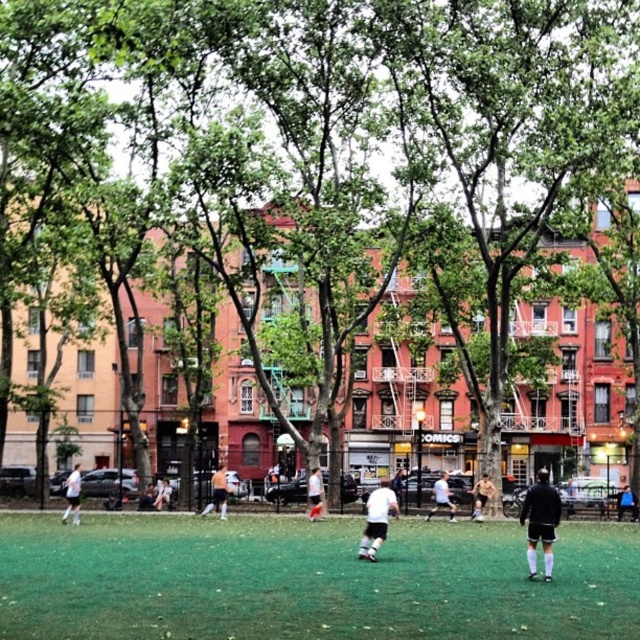
How far apart are white matte soccer player at center and black matte jacket at center?

white matte soccer player at center is 102.49 feet from black matte jacket at center.

Is point (385, 522) closer to viewer compared to point (621, 496)?

Yes, point (385, 522) is closer to viewer.

Is point (380, 518) positioned before point (630, 496)?

That is True.

The width and height of the screenshot is (640, 640). In order to click on white matte soccer player at center in this screenshot , I will do `click(378, 518)`.

Between green artificial turf at center and black matte shorts at center, which one is positioned higher?

Positioned higher is black matte shorts at center.

Between point (275, 627) and point (545, 468), which one is positioned behind?

Point (545, 468)

Find the location of `green artificial turf at center`. green artificial turf at center is located at coordinates (308, 580).

Does white matte shirt at center lie in front of white matte shorts at center?

No, white matte shirt at center is behind white matte shorts at center.

Who is more forward, (x=435, y=483) or (x=308, y=483)?

Point (x=308, y=483) is in front.

Where is `white matte shirt at center`? white matte shirt at center is located at coordinates (442, 497).